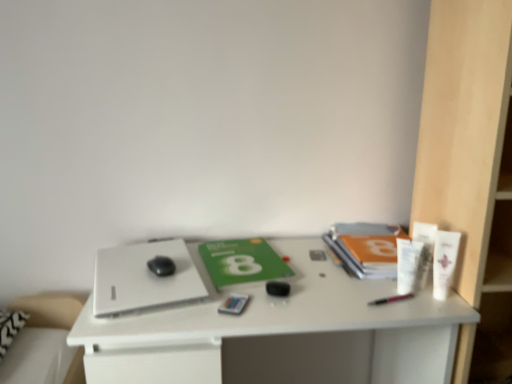
Locate an element on the screen. The height and width of the screenshot is (384, 512). free spot to the left of white matte tube at upper right, the 1th toiletry in the right-to-left sequence is located at coordinates (373, 295).